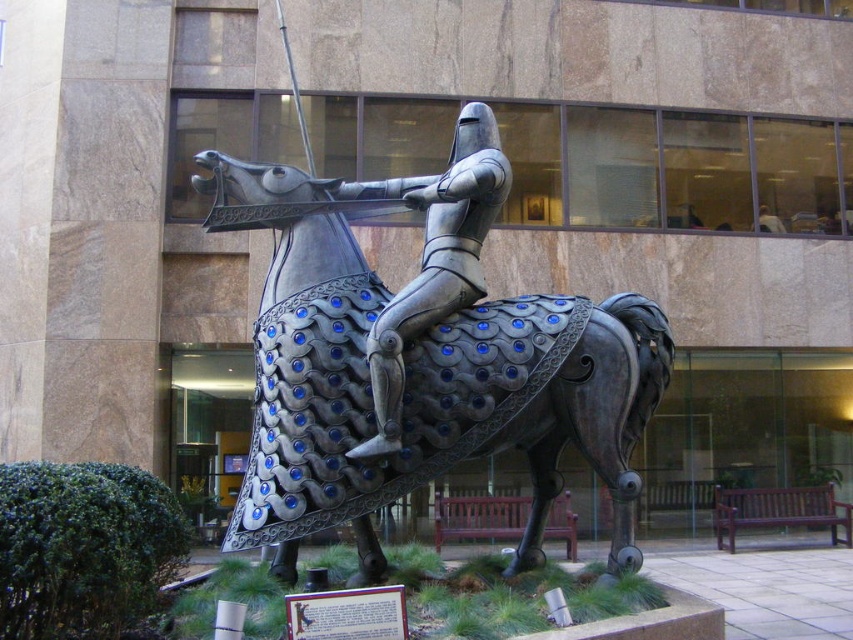
Question: Which of the following is the farthest from the observer?

Choices:
 (A) (323, 460)
 (B) (485, 227)

Answer: (B)

Question: Is metallic armor at center above shiny silver armor at center?

Choices:
 (A) yes
 (B) no

Answer: (B)

Question: Which of the following is the farthest from the observer?

Choices:
 (A) metallic armor at center
 (B) shiny silver armor at center

Answer: (B)

Question: Which object appears farthest from the camera in this image?

Choices:
 (A) shiny silver armor at center
 (B) metallic armor at center

Answer: (A)

Question: Is metallic armor at center to the left of shiny silver armor at center from the viewer's perspective?

Choices:
 (A) yes
 (B) no

Answer: (A)

Question: Where is metallic armor at center located in relation to shiny silver armor at center in the image?

Choices:
 (A) right
 (B) left

Answer: (B)